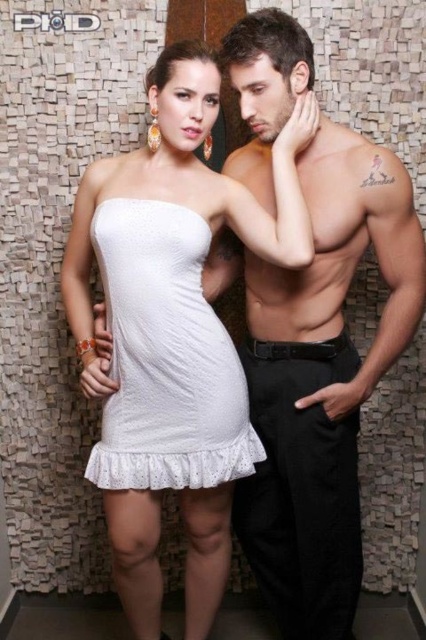
Looking at the scene described, which object is positioned to the left of the other between the white lace dress at center and the white lace underwear at lower center?

The white lace dress at center is positioned to the left of the white lace underwear at lower center.

You are a photographer standing at the camera position. You want to ensure that the white lace dress at center is in focus while keeping the background slightly blurred. What adjustment should you make to the camera settings?

To ensure the white lace dress at center is in focus and blur the background, adjust the camera aperture to a wider setting, such as a lower fstop number, which creates a shallower depth of field.

You are a photographer setting up for a photoshoot and need to ensure proper lighting. The scene includes a white lace dress at center and white lace underwear at lower center. Which item requires more lighting adjustment due to its thickness affecting light absorption?

The white lace underwear at lower center requires more lighting adjustment because it is thicker than the white lace dress at center, which may absorb more light and need additional illumination for visibility.